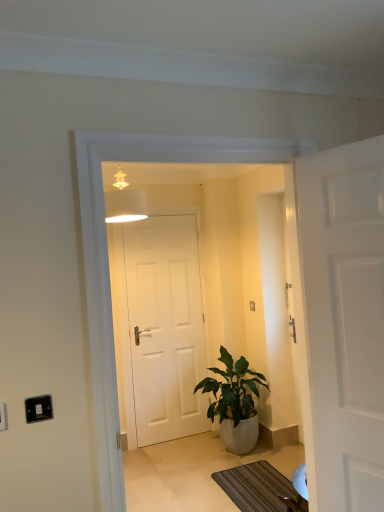
Question: From the image's perspective, is white plastic electric outlet at lower left, which is the 1th electric outlet in front-to-back order, over white matte door at center, the 2th door positioned from the right?

Choices:
 (A) no
 (B) yes

Answer: (B)

Question: From a real-world perspective, is white plastic electric outlet at lower left, which is the 1th electric outlet in front-to-back order, on top of white matte door at center, the 1th door viewed from the left?

Choices:
 (A) yes
 (B) no

Answer: (A)

Question: Considering the relative positions of white plastic electric outlet at lower left, acting as the 2th electric outlet starting from the right, and white matte door at center, the 1th door viewed from the left, in the image provided, is white plastic electric outlet at lower left, acting as the 2th electric outlet starting from the right, to the right of white matte door at center, the 1th door viewed from the left, from the viewer's perspective?

Choices:
 (A) yes
 (B) no

Answer: (B)

Question: Can you confirm if white plastic electric outlet at lower left, positioned as the 1th electric outlet in left-to-right order, is smaller than white matte door at center, the 2th door positioned from the right?

Choices:
 (A) no
 (B) yes

Answer: (B)

Question: From the image's perspective, is white plastic electric outlet at lower left, positioned as the 2th electric outlet in back-to-front order, beneath white matte door at center, the second door viewed from the front?

Choices:
 (A) yes
 (B) no

Answer: (B)

Question: Is white matte door at center, the 1th door viewed from the left, inside white plastic electric outlet at lower left, positioned as the 2th electric outlet in back-to-front order?

Choices:
 (A) yes
 (B) no

Answer: (B)

Question: Is striped fabric doormat at lower center smaller than green glossy plant at center?

Choices:
 (A) no
 (B) yes

Answer: (B)

Question: Is striped fabric doormat at lower center positioned beyond the bounds of green glossy plant at center?

Choices:
 (A) yes
 (B) no

Answer: (A)

Question: Considering the relative sizes of striped fabric doormat at lower center and green glossy plant at center in the image provided, is striped fabric doormat at lower center shorter than green glossy plant at center?

Choices:
 (A) yes
 (B) no

Answer: (A)

Question: Considering the relative positions of striped fabric doormat at lower center and green glossy plant at center in the image provided, is striped fabric doormat at lower center in front of green glossy plant at center?

Choices:
 (A) yes
 (B) no

Answer: (A)

Question: Is striped fabric doormat at lower center oriented towards green glossy plant at center?

Choices:
 (A) yes
 (B) no

Answer: (B)

Question: From the image's perspective, is striped fabric doormat at lower center located beneath green glossy plant at center?

Choices:
 (A) no
 (B) yes

Answer: (B)

Question: From a real-world perspective, is white matte door at right, the second door viewed from the left, on top of black plastic switch at lower left, acting as the 1th electric outlet starting from the back?

Choices:
 (A) yes
 (B) no

Answer: (A)